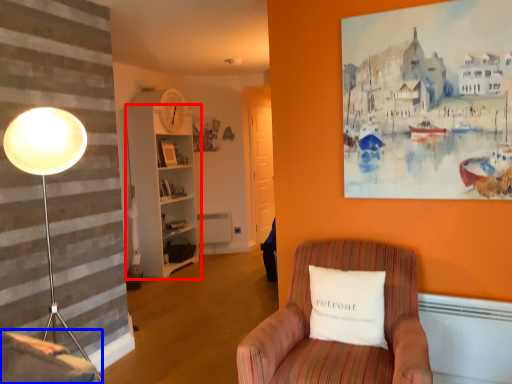
Question: Which of the following is the farthest to the observer, bookshelf (highlighted by a red box) or swivel chair (highlighted by a blue box)?

Choices:
 (A) bookshelf
 (B) swivel chair

Answer: (A)